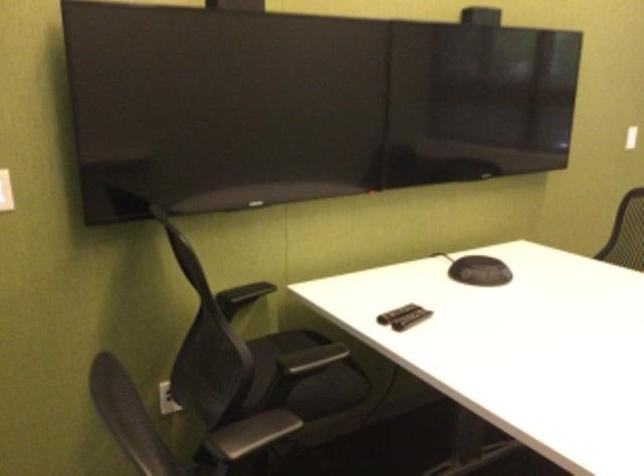
Where is `chair sitting surface`? The width and height of the screenshot is (644, 476). chair sitting surface is located at coordinates (304, 376).